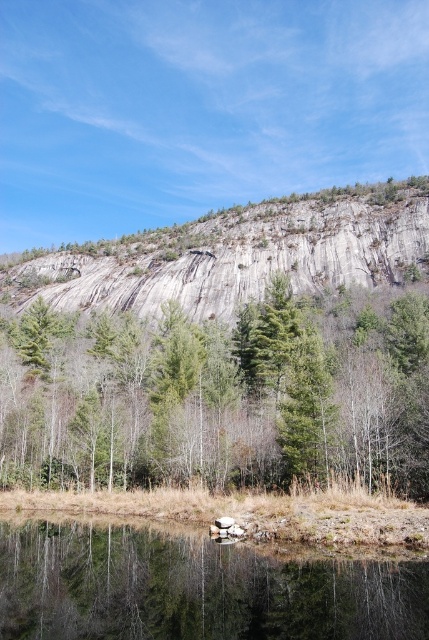
Is green textured tree at center wider than clear water at bottom?

Indeed, green textured tree at center has a greater width compared to clear water at bottom.

Can you confirm if green textured tree at center is positioned above clear water at bottom?

Indeed, green textured tree at center is positioned over clear water at bottom.

The width and height of the screenshot is (429, 640). Describe the element at coordinates (220, 396) in the screenshot. I see `green textured tree at center` at that location.

The height and width of the screenshot is (640, 429). Find the location of `green textured tree at center`. green textured tree at center is located at coordinates (220, 396).

Looking at this image, is clear water at bottom further to camera compared to gray rock cliff at upper center?

No, it is in front of gray rock cliff at upper center.

Who is higher up, clear water at bottom or gray rock cliff at upper center?

gray rock cliff at upper center is above.

Does point (195, 616) lie behind point (392, 268)?

No.

This screenshot has width=429, height=640. I want to click on clear water at bottom, so click(193, 588).

Between green textured tree at center and gray rock cliff at upper center, which one is positioned lower?

Positioned lower is green textured tree at center.

Is green textured tree at center smaller than gray rock cliff at upper center?

Yes, green textured tree at center is smaller than gray rock cliff at upper center.

This screenshot has width=429, height=640. What are the coordinates of `green textured tree at center` in the screenshot? It's located at (220, 396).

This screenshot has height=640, width=429. In order to click on green textured tree at center in this screenshot , I will do `click(220, 396)`.